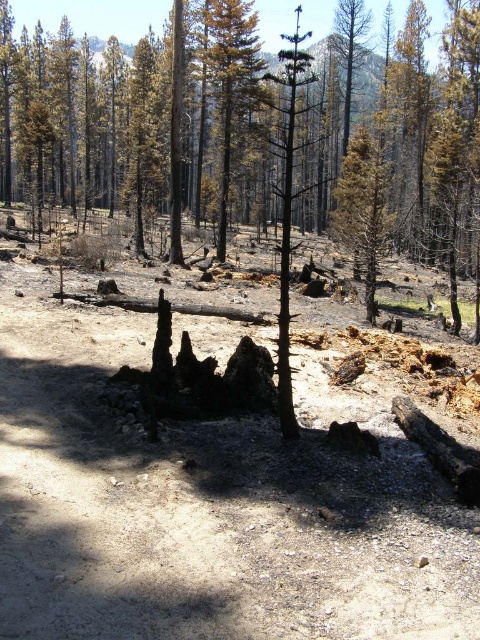
Question: Does yellow-green bark tree at center have a greater width compared to charred wood tree at center?

Choices:
 (A) no
 (B) yes

Answer: (A)

Question: Is yellow-green bark tree at center above charred wood tree at center?

Choices:
 (A) yes
 (B) no

Answer: (B)

Question: Which point is farther from the camera taking this photo?

Choices:
 (A) (224, 4)
 (B) (285, 211)

Answer: (A)

Question: Which point appears farthest from the camera in this image?

Choices:
 (A) click(x=279, y=324)
 (B) click(x=238, y=64)

Answer: (B)

Question: Does yellow-green bark tree at center appear over charred wood tree at center?

Choices:
 (A) yes
 (B) no

Answer: (B)

Question: Which of the following is the farthest from the observer?

Choices:
 (A) coord(300,189)
 (B) coord(237,20)

Answer: (A)